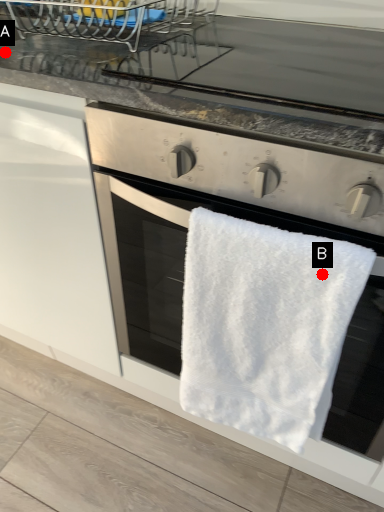
Question: Two points are circled on the image, labeled by A and B beside each circle. Which of the following is the farthest from the observer?

Choices:
 (A) A is further
 (B) B is further

Answer: (A)